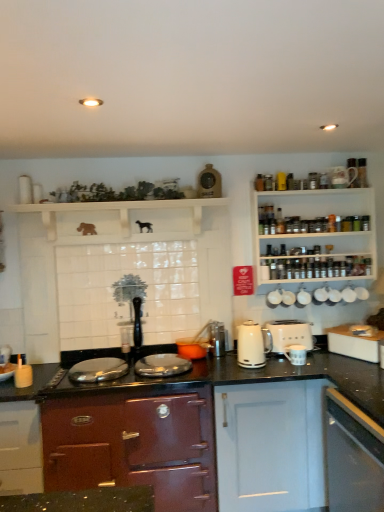
Question: From a real-world perspective, is metallic silver kettle at center, which is the 4th appliance in right-to-left order, positioned above or below white wooden spice rack at upper right?

Choices:
 (A) above
 (B) below

Answer: (B)

Question: Considering the positions of metallic silver kettle at center, the 2th appliance in the left-to-right sequence, and white wooden spice rack at upper right in the image, is metallic silver kettle at center, the 2th appliance in the left-to-right sequence, taller or shorter than white wooden spice rack at upper right?

Choices:
 (A) short
 (B) tall

Answer: (A)

Question: Which object is the closest to the white ceramic mug at lower center, the third appliance when ordered from left to right?

Choices:
 (A) shiny burgundy cabinet at center, the 3th cabinetry from the right
 (B) white glossy electric kettle at center
 (C) white wooden spice rack at upper right
 (D) white glossy cabinet at lower right, the third cabinetry in the left-to-right sequence
 (E) white matte cabinet at lower center, positioned as the second cabinetry in right-to-left order

Answer: (B)

Question: Which object is the closest to the white glossy coffee cup at upper right, marked as the second appliance in a top-to-bottom arrangement?

Choices:
 (A) white glossy cup at upper right, the 2th appliance in the right-to-left sequence
 (B) white glossy electric kettle at center
 (C) white ceramic mug at lower center, the third appliance when ordered from left to right
 (D) white matte toaster at right
 (E) white matte wooden shelf at upper center

Answer: (A)